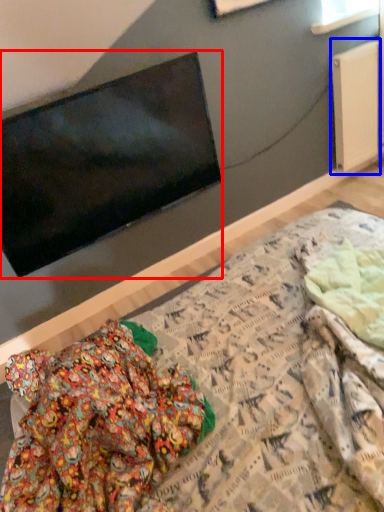
Question: Which object appears farthest to the camera in this image, television (highlighted by a red box) or radiator (highlighted by a blue box)?

Choices:
 (A) television
 (B) radiator

Answer: (B)